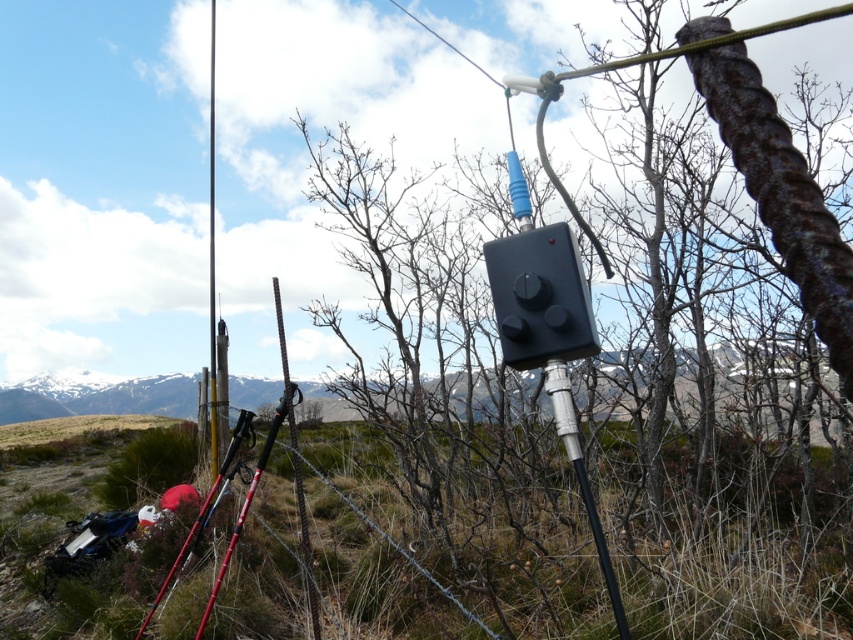
Can you confirm if rusty metal pole at center is wider than red plastic ski pole at lower left?

Indeed, rusty metal pole at center has a greater width compared to red plastic ski pole at lower left.

The width and height of the screenshot is (853, 640). Identify the location of rusty metal pole at center. (642, 186).

Who is lower down, black plastic box at center or smooth black pole at center?

smooth black pole at center is lower down.

How distant is black plastic box at center from smooth black pole at center?

Result: 6.12 meters

Is point (508, 241) closer to camera compared to point (209, 106)?

Yes, point (508, 241) is in front of point (209, 106).

Locate an element on the screen. black plastic box at center is located at coordinates (540, 296).

Measure the distance from rusty metal pole at center to silver metallic ski pole at center.

They are 3.65 meters apart.

Can you confirm if rusty metal pole at center is shorter than silver metallic ski pole at center?

No.

Who is more distant from viewer, (544, 168) or (605, 570)?

Positioned behind is point (544, 168).

Where is `rusty metal pole at center`? rusty metal pole at center is located at coordinates pyautogui.click(x=642, y=186).